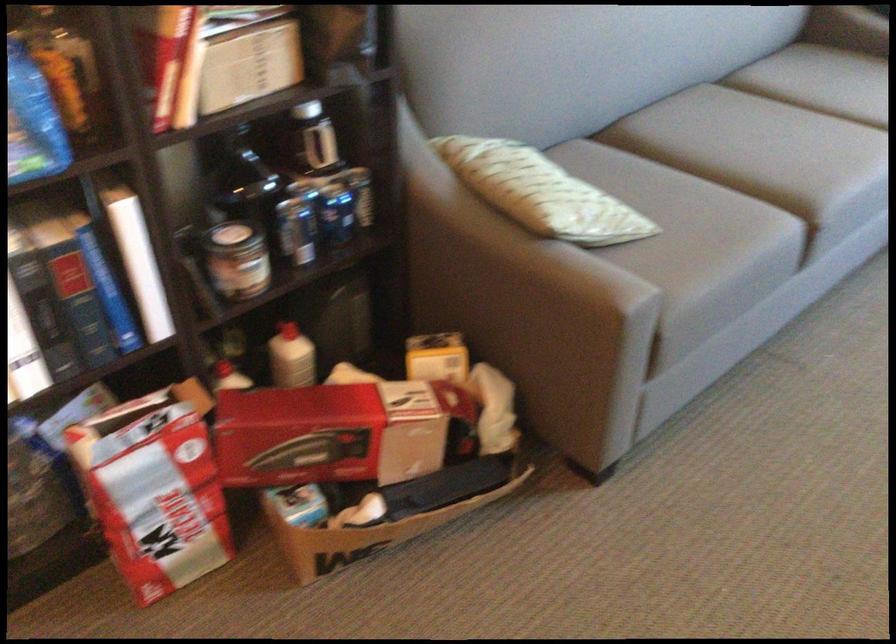
The width and height of the screenshot is (896, 644). What do you see at coordinates (436, 357) in the screenshot? I see `a small yellow box` at bounding box center [436, 357].